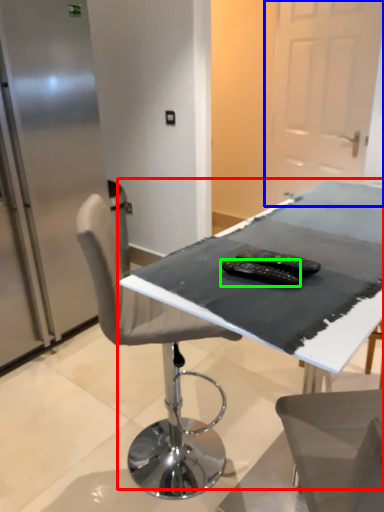
Question: Which object is the farthest from table (highlighted by a red box)? Choose among these: glass door (highlighted by a blue box) or equipment (highlighted by a green box).

Choices:
 (A) glass door
 (B) equipment

Answer: (A)